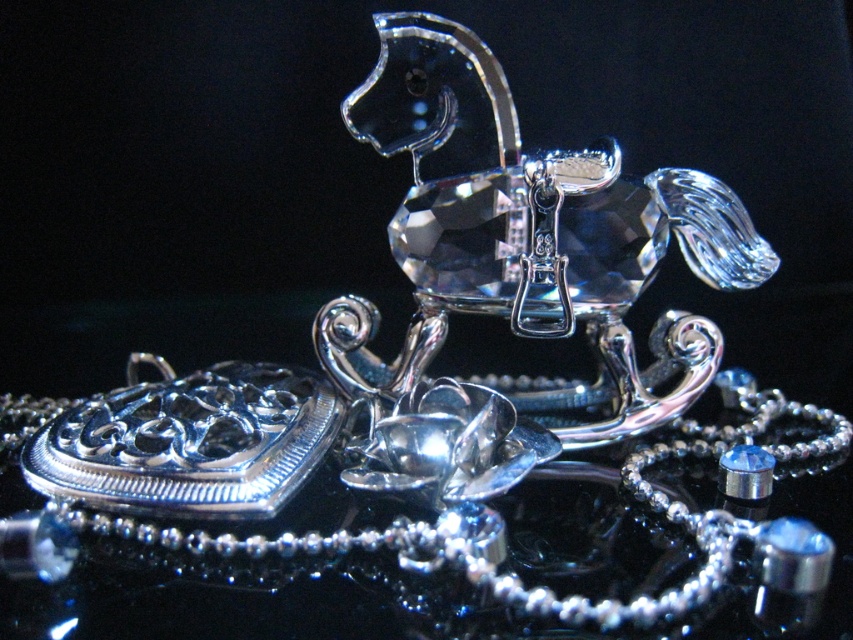
Question: Can you confirm if silver metallic necklace at center is bigger than clear crystal horse at center?

Choices:
 (A) no
 (B) yes

Answer: (B)

Question: Which of the following is the farthest from the observer?

Choices:
 (A) (270, 422)
 (B) (646, 228)

Answer: (B)

Question: Is silver metallic necklace at center further to camera compared to clear crystal horse at center?

Choices:
 (A) no
 (B) yes

Answer: (A)

Question: Which point is closer to the camera taking this photo?

Choices:
 (A) (315, 513)
 (B) (717, 225)

Answer: (A)

Question: Which point appears closest to the camera in this image?

Choices:
 (A) (666, 330)
 (B) (576, 618)

Answer: (B)

Question: Can you confirm if silver metallic necklace at center is positioned below clear crystal horse at center?

Choices:
 (A) no
 (B) yes

Answer: (B)